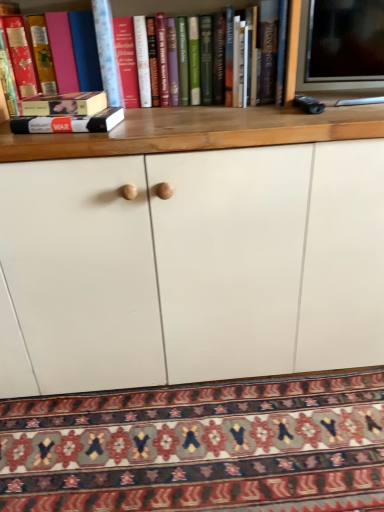
At what (x,y) coordinates should I click in order to perform the action: click on free space on the front side of hardcover book at left, which appears as the second book when viewed from the top. Please return your answer as a coordinate pair (x, y). The height and width of the screenshot is (512, 384). Looking at the image, I should click on pos(68,135).